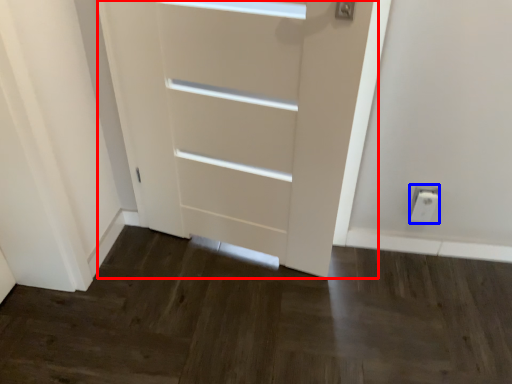
Question: Among these objects, which one is nearest to the camera, door (highlighted by a red box) or electric outlet (highlighted by a blue box)?

Choices:
 (A) door
 (B) electric outlet

Answer: (A)